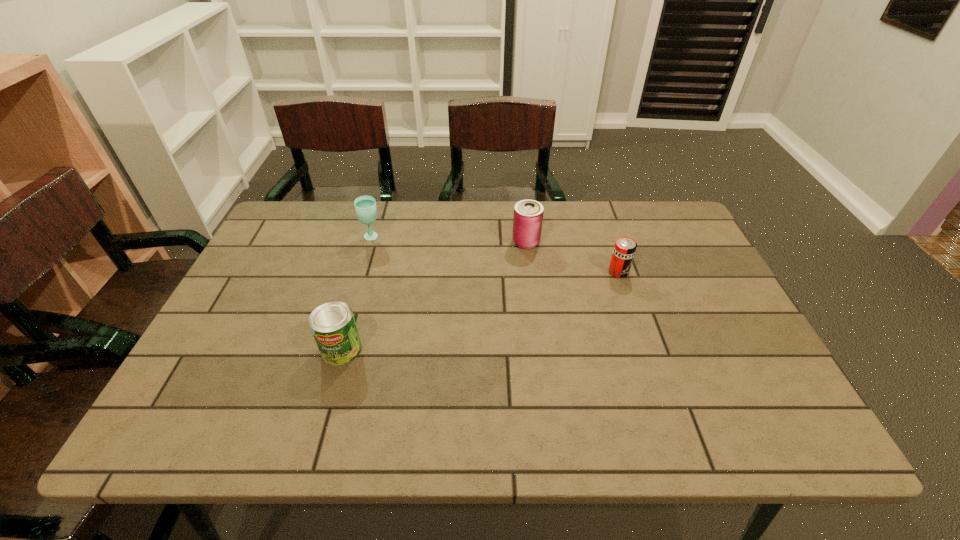
Identify the location of free point between the second can from left to right and the leftmost can. (434, 295).

Identify the location of object that is the third closest to the glass. Image resolution: width=960 pixels, height=540 pixels. (624, 249).

Identify which object is the second closest to the rightmost can. Please provide its 2D coordinates. Your answer should be formatted as a tuple, i.e. [(x, y)], where the tuple contains the x and y coordinates of a point satisfying the conditions above.

[(365, 206)]

Identify which can is the second nearest to the second farthest can. Please provide its 2D coordinates. Your answer should be formatted as a tuple, i.e. [(x, y)], where the tuple contains the x and y coordinates of a point satisfying the conditions above.

[(333, 325)]

Identify which can is the second nearest to the glass. Please provide its 2D coordinates. Your answer should be formatted as a tuple, i.e. [(x, y)], where the tuple contains the x and y coordinates of a point satisfying the conditions above.

[(528, 214)]